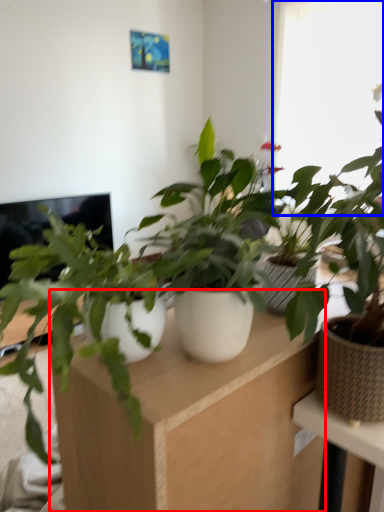
Question: Which object appears farthest to the camera in this image, computer desk (highlighted by a red box) or window (highlighted by a blue box)?

Choices:
 (A) computer desk
 (B) window

Answer: (B)